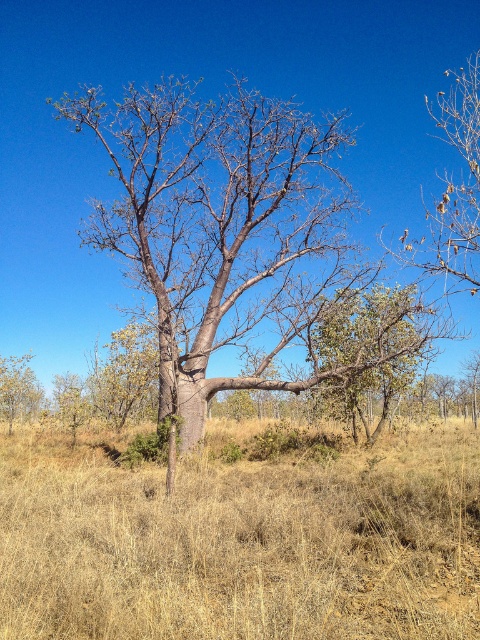
You are a hiker who wants to navigate through the dry grass at center and the bare branches at upper right. Which object is lower in the image?

The dry grass at center is located below the bare branches at upper right, so the dry grass at center is lower in the image.

You are a hiker who wants to take a photo of the green leafy tree at left without the dry grass at center blocking the view. Which direction should you move to get a clear shot?

The dry grass at center is in front of the green leafy tree at left, so you should move to the right side of the tree to avoid the obstruction caused by the dry grass at center.

You are a hiker trying to navigate through the dry grass at center and the bare branches at upper right. Which area would allow you to move through more easily?

The dry grass at center occupies less space than the bare branches at upper right, so moving through the dry grass at center would be easier as it has more open space.